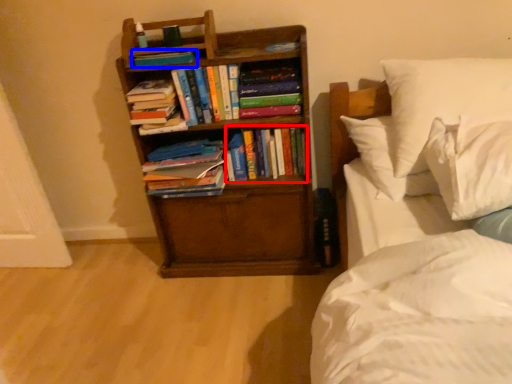
Question: Which object is further to the camera taking this photo, book (highlighted by a red box) or book (highlighted by a blue box)?

Choices:
 (A) book
 (B) book

Answer: (A)